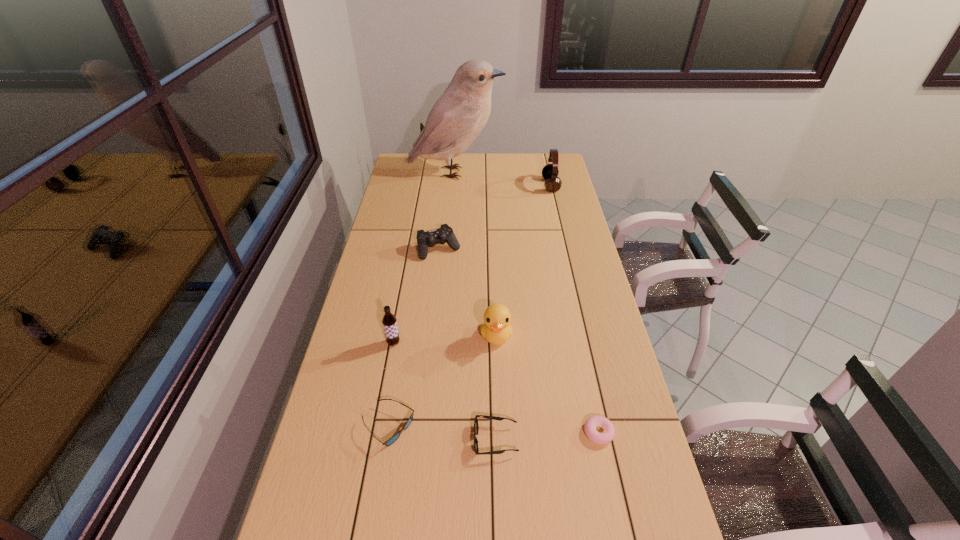
Locate an element on the screen. This screenshot has width=960, height=540. vacant space located 0.240m on the ear pads of the headset is located at coordinates (493, 185).

The width and height of the screenshot is (960, 540). What are the coordinates of `free space located on the ear pads of the headset` in the screenshot? It's located at (461, 185).

At what (x,y) coordinates should I click in order to perform the action: click on free spot located on the ear pads of the headset. Please return your answer as a coordinate pair (x, y). Looking at the image, I should click on (x=470, y=185).

Where is `vacant space located 0.220m on the back of the root beer`? vacant space located 0.220m on the back of the root beer is located at coordinates (403, 291).

Find the location of a particular element. Image resolution: width=960 pixels, height=540 pixels. vacant space located on the face of the duck is located at coordinates (501, 476).

What are the coordinates of `vacant area situated 0.060m on the right of the control` in the screenshot? It's located at pyautogui.click(x=475, y=249).

Where is `blank space located at the front of the left sunglasses showing the lenses`? blank space located at the front of the left sunglasses showing the lenses is located at coordinates (484, 427).

Where is `vacant space located 0.340m on the front-facing side of the right sunglasses`? This screenshot has width=960, height=540. vacant space located 0.340m on the front-facing side of the right sunglasses is located at coordinates (347, 440).

Find the location of `vacant space located 0.310m on the front-facing side of the right sunglasses`. vacant space located 0.310m on the front-facing side of the right sunglasses is located at coordinates (358, 440).

You are a GUI agent. You are given a task and a screenshot of the screen. Output one action in this format:
    pyautogui.click(x=<x>, y=<y>)
    Task: Click on the vacant area situated 0.090m on the front-facing side of the right sunglasses
    The width and height of the screenshot is (960, 540).
    Given the screenshot: What is the action you would take?
    pyautogui.click(x=440, y=440)